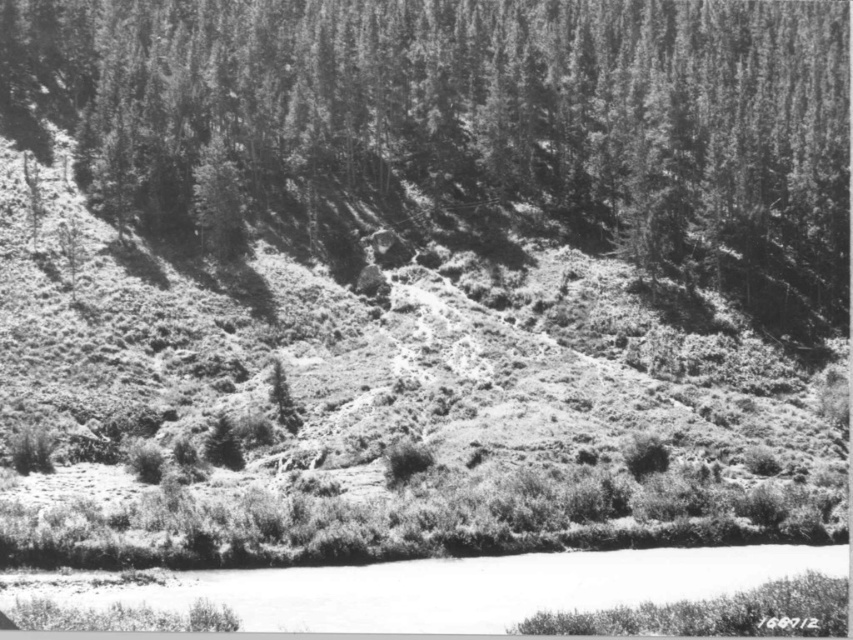
Question: Can you confirm if grassy hillside at center is bigger than white smooth water at lower center?

Choices:
 (A) yes
 (B) no

Answer: (A)

Question: Is grassy hillside at center closer to the viewer compared to smooth bark tree at upper center?

Choices:
 (A) yes
 (B) no

Answer: (A)

Question: Which point is closer to the camera taking this photo?

Choices:
 (A) 175,534
 (B) 593,556

Answer: (A)

Question: Among these points, which one is farthest from the camera?

Choices:
 (A) (648, 88)
 (B) (22, 442)
 (C) (463, 566)

Answer: (A)

Question: Which of the following is the closest to the observer?

Choices:
 (A) grassy hillside at center
 (B) smooth bark tree at upper center
 (C) white smooth water at lower center

Answer: (C)

Question: Does grassy hillside at center appear over smooth bark tree at upper center?

Choices:
 (A) yes
 (B) no

Answer: (B)